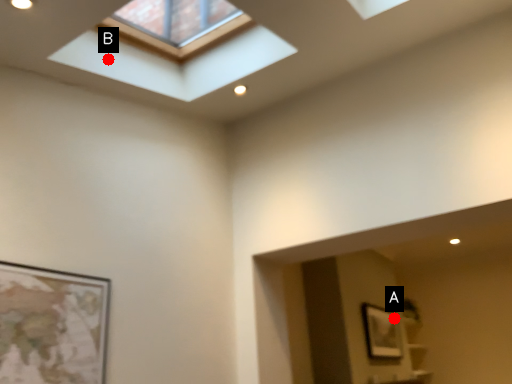
Question: Two points are circled on the image, labeled by A and B beside each circle. Which point is further to the camera?

Choices:
 (A) A is further
 (B) B is further

Answer: (A)